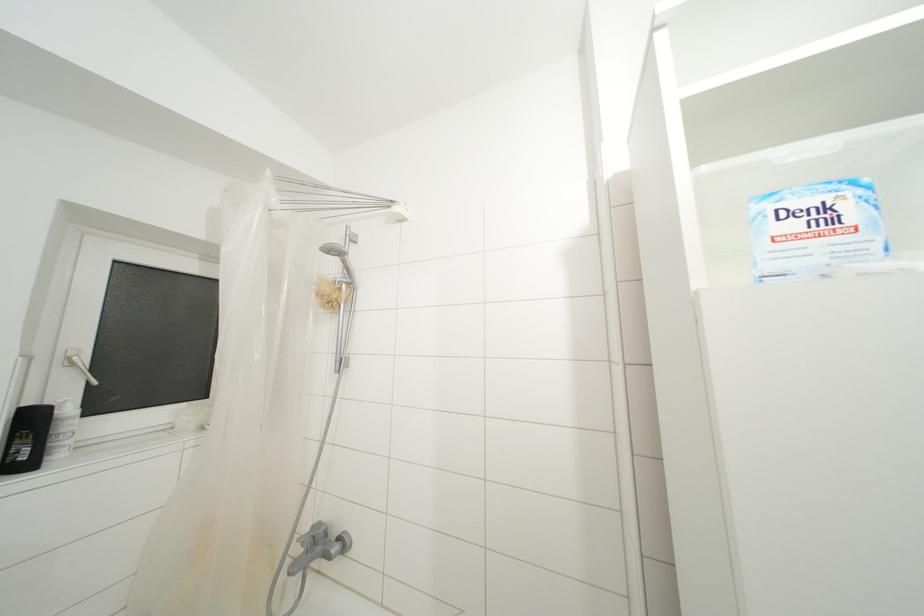
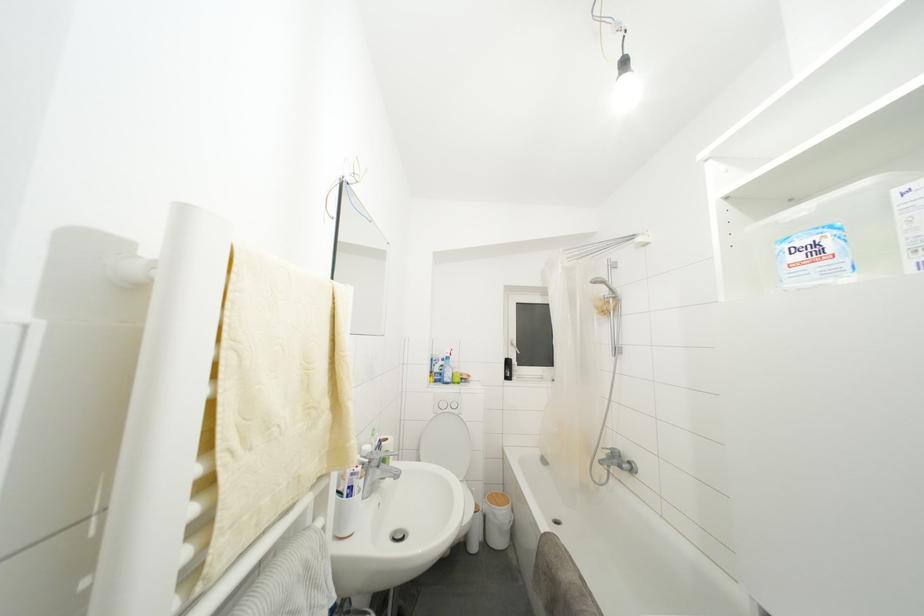
Question: The camera is either moving clockwise (left) or counter-clockwise (right) around the object. The first image is from the beginning of the video and the second image is from the end. Is the camera moving left or right when shooting the video?

Choices:
 (A) Left
 (B) Right

Answer: (B)